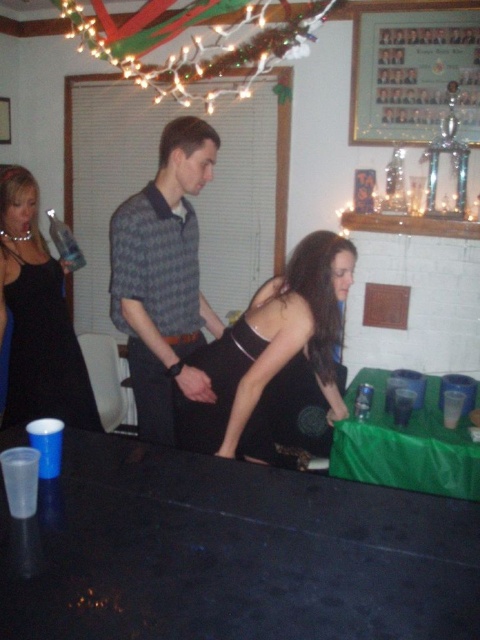
Does gray checkered shirt at center have a smaller size compared to metallic trophy at upper right?

No.

Is point (166, 138) positioned before point (469, 19)?

That is True.

Who is more distant from viewer, (x=153, y=284) or (x=351, y=108)?

Point (x=351, y=108)

This screenshot has width=480, height=640. Find the location of `gray checkered shirt at center`. gray checkered shirt at center is located at coordinates (164, 276).

Does gray checkered shirt at center lie in front of black satin dress at left?

Yes, it is.

The height and width of the screenshot is (640, 480). Describe the element at coordinates (164, 276) in the screenshot. I see `gray checkered shirt at center` at that location.

At what (x,y) coordinates should I click in order to perform the action: click on gray checkered shirt at center. Please return your answer as a coordinate pair (x, y). Looking at the image, I should click on (164, 276).

Is clear plastic cup at table center below transparent plastic cup at lower right?

Correct, clear plastic cup at table center is located below transparent plastic cup at lower right.

Is clear plastic cup at table center closer to the viewer compared to transparent plastic cup at lower right?

No, clear plastic cup at table center is behind transparent plastic cup at lower right.

Between point (395, 400) and point (447, 401), which one is positioned behind?

The point (395, 400) is behind.

The image size is (480, 640). I want to click on clear plastic cup at table center, so click(403, 404).